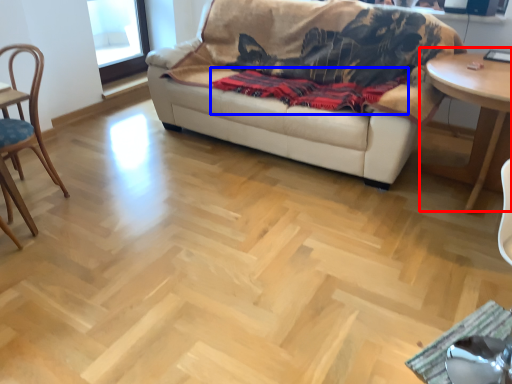
Question: Which object is further to the camera taking this photo, table (highlighted by a red box) or blanket (highlighted by a blue box)?

Choices:
 (A) table
 (B) blanket

Answer: (B)